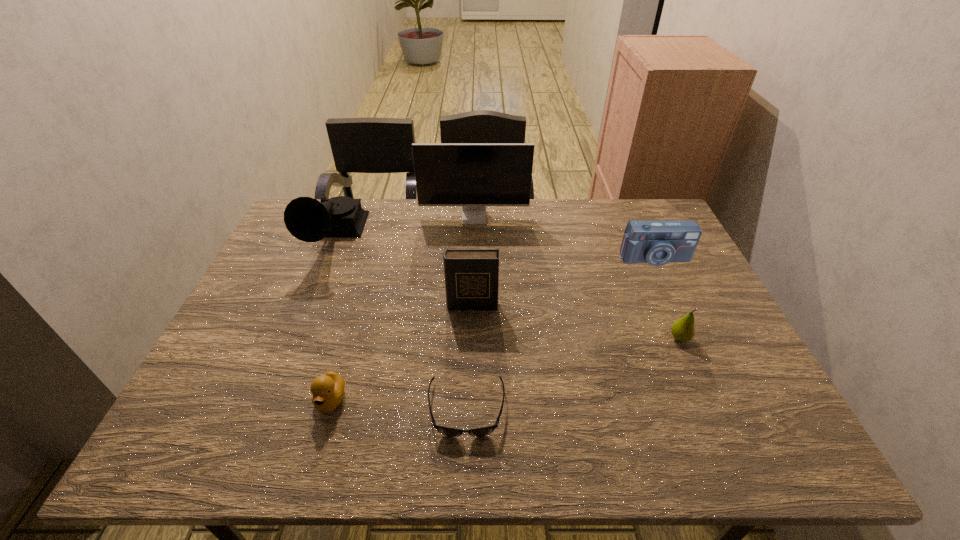
The image size is (960, 540). What are the coordinates of `free spot between the fourth nearest object and the fifth tallest object` in the screenshot? It's located at (576, 321).

Where is `free space between the leftmost object and the fifth tallest object`? free space between the leftmost object and the fifth tallest object is located at coordinates (506, 288).

This screenshot has width=960, height=540. I want to click on free point between the sixth tallest object and the monitor, so click(x=402, y=309).

Identify the location of free space between the third nearest object and the camera. (666, 298).

The image size is (960, 540). Identify the location of vacant region between the sixth shortest object and the duckling. (332, 320).

Locate an element on the screen. free point between the monitor and the third nearest object is located at coordinates (577, 278).

This screenshot has width=960, height=540. Identify the location of blank region between the third tallest object and the camera. (563, 282).

Locate an element on the screen. The image size is (960, 540). free spot between the second object from left to right and the shortest object is located at coordinates (398, 404).

At what (x,y) coordinates should I click in order to perform the action: click on vacant area that lies between the sunglasses and the diary. Please return your answer as a coordinate pair (x, y). Looking at the image, I should click on [469, 357].

Identify which object is located as the sixth nearest to the sunglasses. Please provide its 2D coordinates. Your answer should be formatted as a tuple, i.e. [(x, y)], where the tuple contains the x and y coordinates of a point satisfying the conditions above.

[(473, 175)]